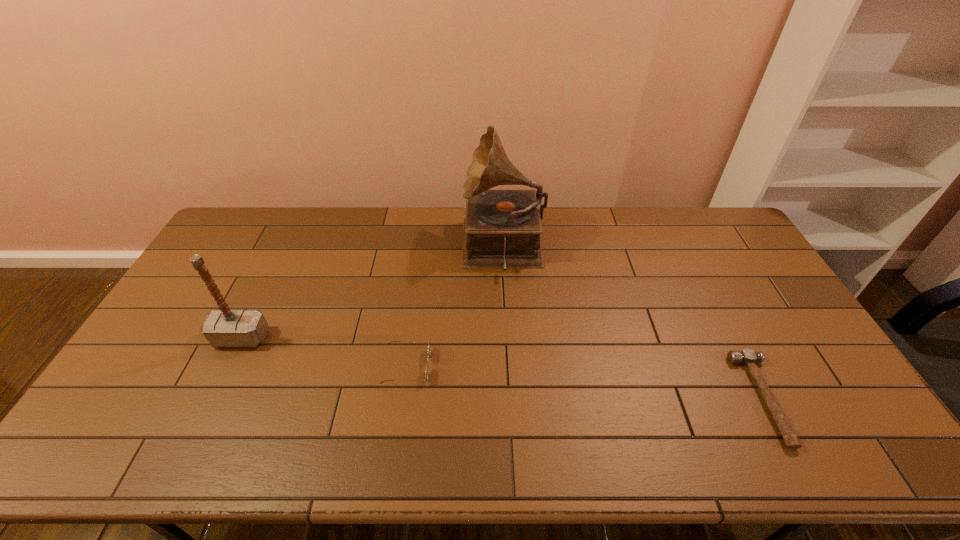
This screenshot has width=960, height=540. In order to click on vacant region at the left edge of the desktop in this screenshot , I will do pos(226,256).

You are a GUI agent. You are given a task and a screenshot of the screen. Output one action in this format:
    pyautogui.click(x=<x>, y=<y>)
    Task: Click on the free space at the right edge of the desktop
    The width and height of the screenshot is (960, 540).
    Given the screenshot: What is the action you would take?
    pyautogui.click(x=834, y=388)

In the image, there is a desktop. Where is `free region at the far left corner`? The width and height of the screenshot is (960, 540). free region at the far left corner is located at coordinates (241, 219).

The height and width of the screenshot is (540, 960). What are the coordinates of `free region at the far right corner` in the screenshot? It's located at (722, 211).

I want to click on unoccupied area between the taller hammer and the third object from right to left, so click(x=324, y=352).

At what (x,y) coordinates should I click in order to perform the action: click on unoccupied position between the right hammer and the second shortest object. Please return your answer as a coordinate pair (x, y). Looking at the image, I should click on (586, 382).

Locate an element on the screen. free space between the third object from left to right and the second shortest object is located at coordinates (455, 307).

Image resolution: width=960 pixels, height=540 pixels. In order to click on free space between the farthest object and the third tallest object in this screenshot , I will do `click(455, 307)`.

At what (x,y) coordinates should I click in order to perform the action: click on free space that is in between the third shortest object and the nearer hammer. Please return your answer as a coordinate pair (x, y). This screenshot has width=960, height=540. Looking at the image, I should click on (503, 368).

This screenshot has height=540, width=960. Find the location of `vacant area that lies between the second tallest object and the shortest object`. vacant area that lies between the second tallest object and the shortest object is located at coordinates (503, 368).